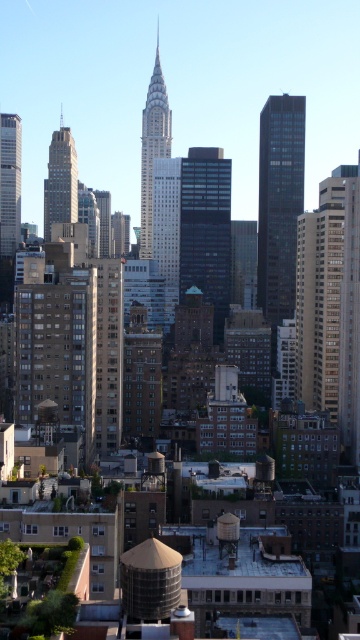
You are an urban planner analyzing the skyline. You need to determine which building occupies more horizontal space in the image. Which one is wider between the gold glass skyscraper at center and the matte brown building at left?

The gold glass skyscraper at center is wider than the matte brown building at left, as its width surpasses the latter.

You are an architect analyzing the urban layout. From your current viewpoint, which building is closer to the foreground between the gold glass skyscraper at center and the matte brown building at left?

The gold glass skyscraper at center is positioned under the matte brown building at left, meaning the matte brown building at left is closer to the foreground.

You are standing at the point with coordinates (330, 300). Looking around, you see the gold glass skyscraper at center. Can you tell me which direction the gold glass skyscraper at center is located relative to your current position?

The gold glass skyscraper at center is located at the point (330, 300), which is exactly where you are standing. Therefore, you are at the same location as the gold glass skyscraper at center.